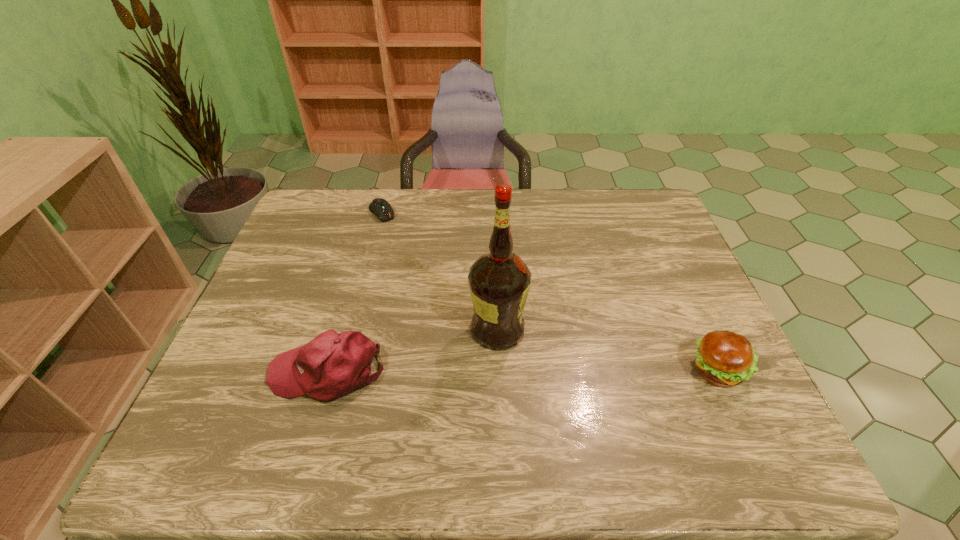
Where is `free point located 0.320m on the button of the shortest object`? free point located 0.320m on the button of the shortest object is located at coordinates (431, 280).

Identify the location of free space located 0.150m on the label of the third object from left to right. (577, 372).

The image size is (960, 540). I want to click on vacant space located 0.340m on the label of the third object from left to right, so click(658, 416).

Locate an element on the screen. free location located on the label of the third object from left to right is located at coordinates (639, 406).

Where is `object present at the far edge`? This screenshot has height=540, width=960. object present at the far edge is located at coordinates (380, 207).

I want to click on baseball cap situated at the near edge, so click(x=332, y=365).

Locate an element on the screen. Image resolution: width=960 pixels, height=540 pixels. hamburger situated at the near edge is located at coordinates (724, 358).

This screenshot has width=960, height=540. I want to click on object that is at the left edge, so click(x=332, y=365).

At what (x,y) coordinates should I click in order to perform the action: click on object present at the right edge. Please return your answer as a coordinate pair (x, y). Looking at the image, I should click on (724, 358).

Image resolution: width=960 pixels, height=540 pixels. In order to click on object that is at the near left corner in this screenshot , I will do `click(332, 365)`.